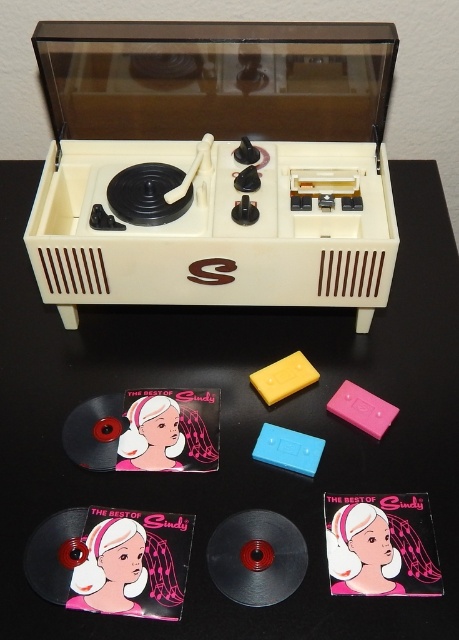
You are organizing a child birthday party and need to place the beige plastic record player at center and the matte pink vinyl record at lower left on a shelf. If the shelf is only wide enough for one item, which item should you prioritize placing first to ensure it fits?

The matte pink vinyl record at lower left should be placed first because the beige plastic record player at center is to the right of it, meaning the record player requires more space to its right side. By placing the smaller record first on the left, there will be enough space remaining for the larger record player.

What are the coordinates of the beige plastic record player at center?

The beige plastic record player at center is located at coordinates point (x=214, y=164).

You are organizing a music collection and need to place the black plastic record at center and the matte pink vinyl record at lower center on a shelf. Based on their positions in the image, which record should you place first to maintain the same arrangement?

The matte pink vinyl record at lower center should be placed first because the black plastic record at center is behind it in the image, meaning it needs to be positioned in front to replicate the arrangement.